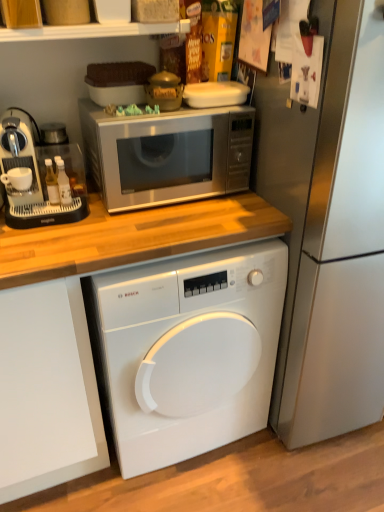
Locate an element on the screen. This screenshot has height=512, width=384. vacant area that is in front of white plastic coffee machine at left is located at coordinates (51, 241).